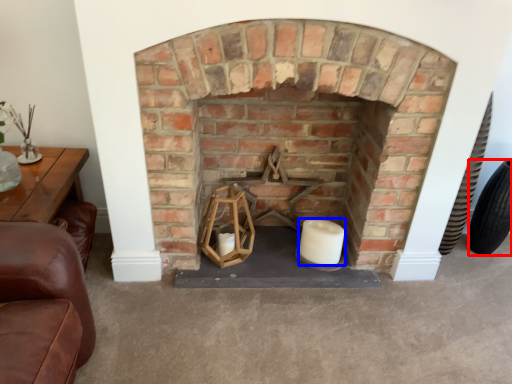
Question: Which object is further to the camera taking this photo, tire (highlighted by a red box) or candle (highlighted by a blue box)?

Choices:
 (A) tire
 (B) candle

Answer: (A)